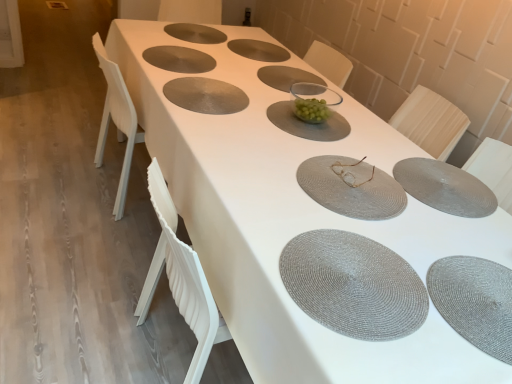
You are a GUI agent. You are given a task and a screenshot of the screen. Output one action in this format:
    pyautogui.click(x=<x>, y=<y>)
    Task: Click on the free spot above matte gray placemat at center, which is counted as the third tableware, starting from the bottom (from a real-world perspective)
    The height and width of the screenshot is (384, 512).
    Given the screenshot: What is the action you would take?
    pyautogui.click(x=354, y=185)